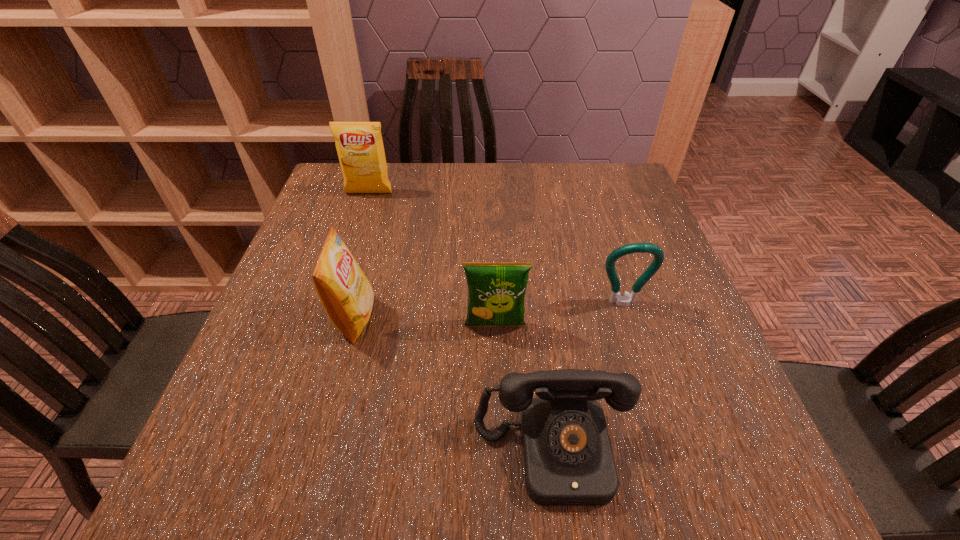
Locate an element on the screen. This screenshot has height=540, width=960. the farthest object is located at coordinates (359, 145).

In order to click on the rightmost object in this screenshot , I will do `click(623, 301)`.

Where is `the rightmost crisp (potato chip)`? the rightmost crisp (potato chip) is located at coordinates (496, 291).

Image resolution: width=960 pixels, height=540 pixels. In order to click on the shortest object in this screenshot , I will do `click(568, 460)`.

The width and height of the screenshot is (960, 540). I want to click on the nearest object, so click(x=568, y=460).

Where is `free region located 0.150m on the front of the farthest object with the logo`? This screenshot has width=960, height=540. free region located 0.150m on the front of the farthest object with the logo is located at coordinates (356, 231).

At what (x,y) coordinates should I click in order to perform the action: click on free location located 0.110m at the jaws of the bottle opener. Please return your answer as a coordinate pair (x, y). The image size is (960, 540). Looking at the image, I should click on coord(638,354).

At what (x,y) coordinates should I click in order to perform the action: click on free location located 0.130m on the front-facing side of the rightmost crisp (potato chip). Please return your answer as a coordinate pair (x, y). Image resolution: width=960 pixels, height=540 pixels. Looking at the image, I should click on [497, 393].

The image size is (960, 540). I want to click on object positioned at the far edge, so click(359, 145).

The width and height of the screenshot is (960, 540). Identify the location of object at the near edge. (568, 460).